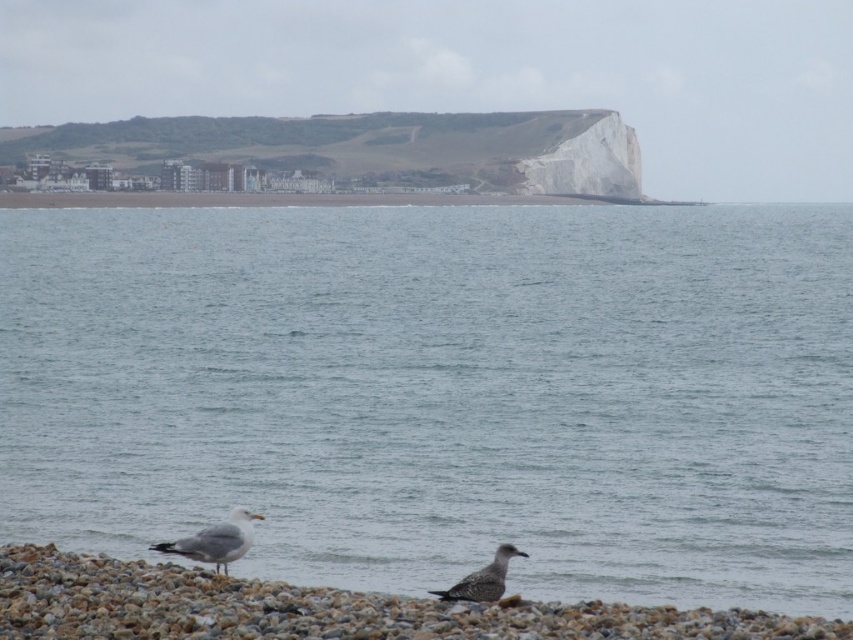
You are standing on the pebble beach and see the gray matte seagull at lower left and the speckled feathered bird at lower center. Which bird is closer to your left side?

The gray matte seagull at lower left is closer to your left side because it is positioned to the left of the speckled feathered bird at lower center.

You are standing on the pebble beach and see the gray pebble at lower center and the gray matte seagull at lower left. Which object is positioned to the right of the other?

The gray pebble at lower center is to the right of the gray matte seagull at lower left.